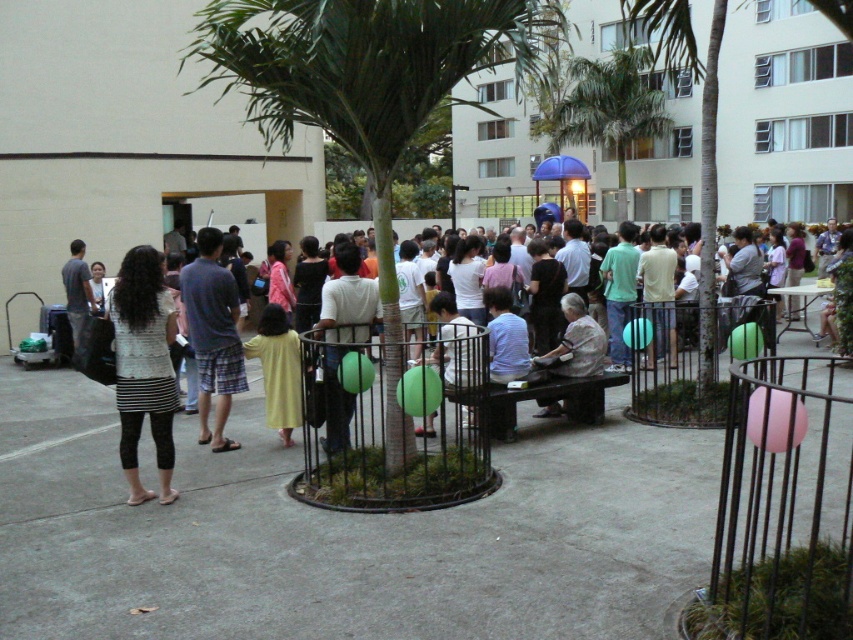
Based on the photo, you are standing at point (225, 355) and want to walk to the courtyard entrance located at point (132, 502). Is there a clear path between these two points?

Yes, there is a clear path between point (132, 502) and point (225, 355) since point (132, 502) is in front of point (225, 355), indicating no obstructions between them.

You are at the courtyard gathering and want to take a photo of yourself with the green leafy palm tree at center. However, there is a yellow fabric dress at center in the way. Can you see the tree in the background through the dress?

The yellow fabric dress at center is behind the green leafy palm tree at center, so the tree is in front of the dress. Therefore, you can see the green leafy palm tree at center in the background without any obstruction from the dress.